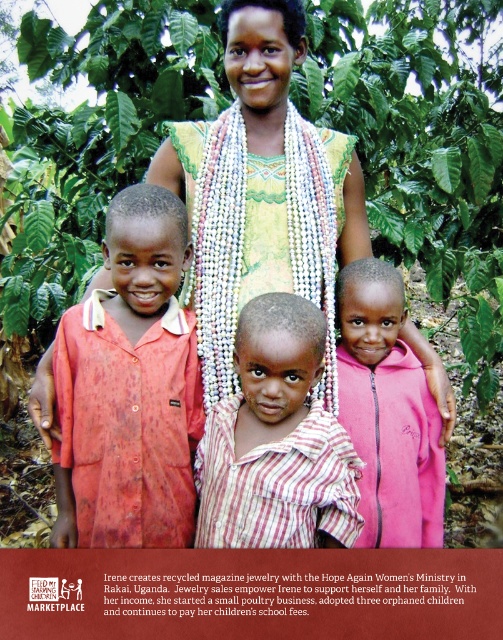
Does matte red shirt at center appear under pink fleece jacket at lower right?

Actually, matte red shirt at center is above pink fleece jacket at lower right.

Is matte red shirt at center to the left of pink fleece jacket at lower right from the viewer's perspective?

Correct, you'll find matte red shirt at center to the left of pink fleece jacket at lower right.

Who is more distant from viewer, (196, 353) or (414, 486)?

Point (414, 486)

This screenshot has width=503, height=640. I want to click on matte red shirt at center, so click(x=129, y=388).

Can you confirm if matte red shirt at center is positioned below striped cotton shirt at center?

Incorrect, matte red shirt at center is not positioned below striped cotton shirt at center.

Does matte red shirt at center have a greater width compared to striped cotton shirt at center?

In fact, matte red shirt at center might be narrower than striped cotton shirt at center.

Which is behind, point (112, 481) or point (356, 465)?

Positioned behind is point (356, 465).

Identify the location of matte red shirt at center. The height and width of the screenshot is (640, 503). (129, 388).

Measure the distance from striped cotton shirt at center to yellow-green woven fabric at center.

striped cotton shirt at center is 52.97 centimeters from yellow-green woven fabric at center.

Image resolution: width=503 pixels, height=640 pixels. In order to click on striped cotton shirt at center in this screenshot , I will do `click(276, 442)`.

Find the location of a particular element. This screenshot has width=503, height=640. striped cotton shirt at center is located at coordinates (276, 442).